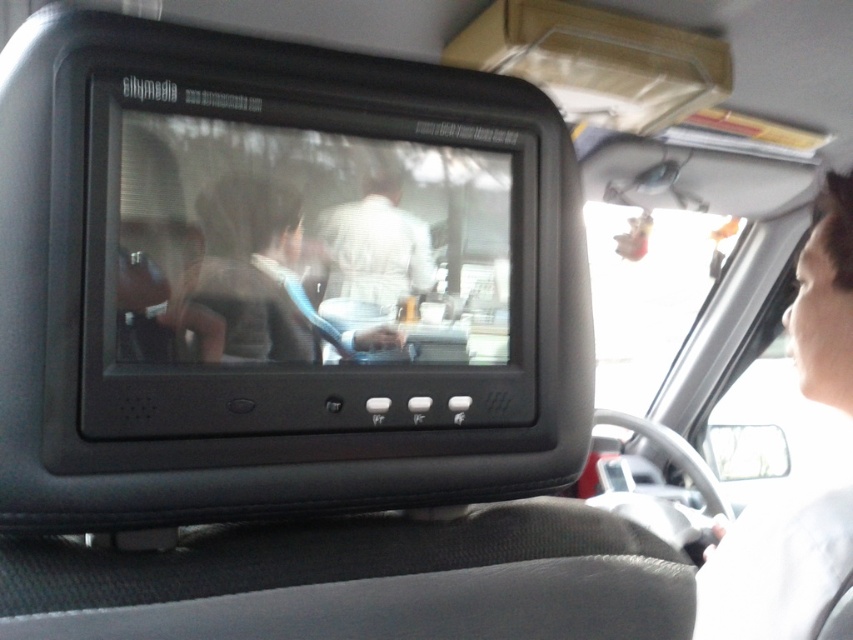
Does matte black monitor at center have a smaller size compared to light brown hair at upper right?

Yes.

Between matte black monitor at center and light brown hair at upper right, which one has more height?

Standing taller between the two is light brown hair at upper right.

The image size is (853, 640). Identify the location of matte black monitor at center. (303, 260).